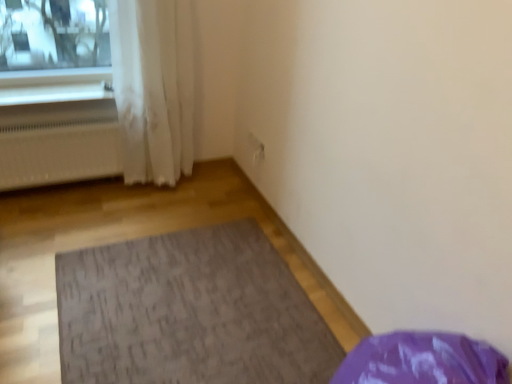
Question: Relative to white plastic window sill at upper left, is white matte radiator at left in front or behind?

Choices:
 (A) behind
 (B) front

Answer: (B)

Question: Would you say white matte radiator at left is inside or outside white plastic window sill at upper left?

Choices:
 (A) inside
 (B) outside

Answer: (B)

Question: Estimate the real-world distances between objects in this image. Which object is closer to the white matte radiator at left?

Choices:
 (A) white plastic window sill at upper left
 (B) white sheer curtain at left
 (C) textured gray mat at center

Answer: (A)

Question: Which of these objects is positioned farthest from the white plastic window sill at upper left?

Choices:
 (A) white sheer curtain at left
 (B) textured gray mat at center
 (C) white matte radiator at left

Answer: (B)